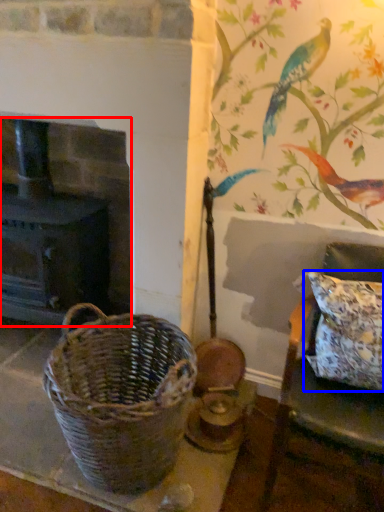
Question: Which object appears farthest to the camera in this image, fireplace (highlighted by a red box) or pillow (highlighted by a blue box)?

Choices:
 (A) fireplace
 (B) pillow

Answer: (A)